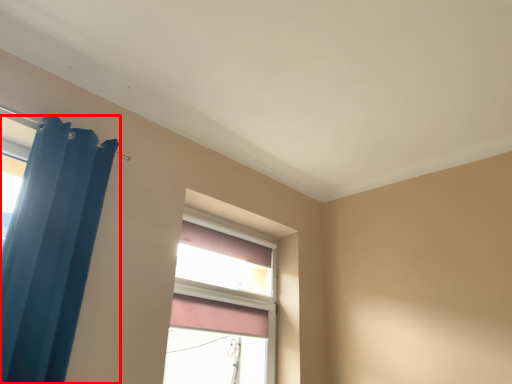
Question: In this image, where is curtain (annotated by the red box) located relative to window?

Choices:
 (A) right
 (B) left

Answer: (B)